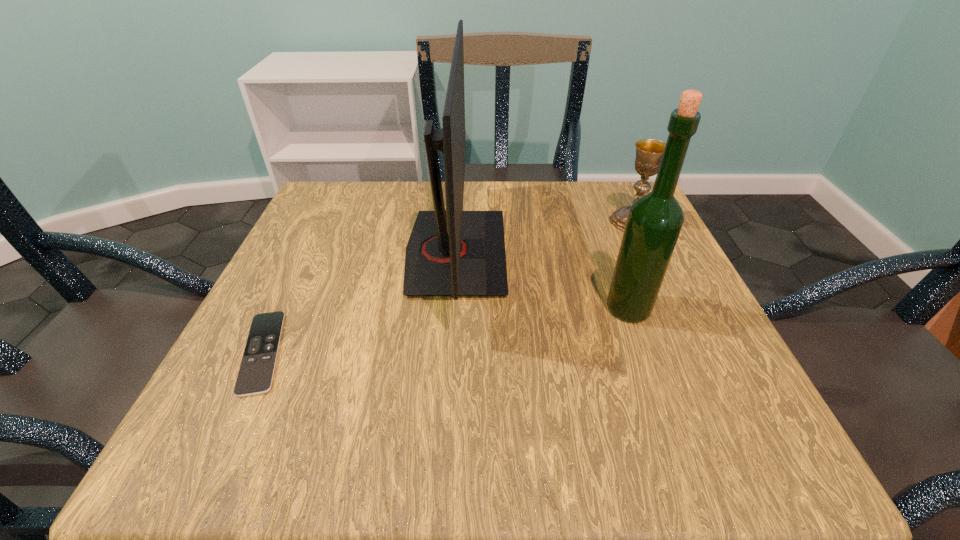
This screenshot has height=540, width=960. In order to click on vacant space at the near left corner of the desktop in this screenshot , I will do `click(193, 442)`.

The image size is (960, 540). In the image, there is a desktop. In order to click on vacant space at the near right corner in this screenshot , I will do `click(704, 421)`.

This screenshot has height=540, width=960. Find the location of `free spot between the third object from right to left and the leftmost object`. free spot between the third object from right to left and the leftmost object is located at coordinates (359, 302).

At what (x,y) coordinates should I click in order to perform the action: click on free space between the liquor and the remote control. Please return your answer as a coordinate pair (x, y). This screenshot has width=960, height=540. Looking at the image, I should click on (445, 330).

Find the location of a particular element. The image size is (960, 540). free space between the third tallest object and the third object from right to left is located at coordinates (544, 237).

Identify the location of vacant area between the liquor and the third object from right to left. The height and width of the screenshot is (540, 960). (542, 280).

This screenshot has height=540, width=960. Find the location of `empty space that is in between the shortest object and the liquor`. empty space that is in between the shortest object and the liquor is located at coordinates (445, 330).

Identify the location of blank region between the leftmost object and the second object from left to right. The image size is (960, 540). (359, 302).

This screenshot has width=960, height=540. I want to click on empty space between the chalice and the second object from left to right, so click(544, 237).

Find the location of `vacant region between the remote control and the liquor`. vacant region between the remote control and the liquor is located at coordinates (445, 330).